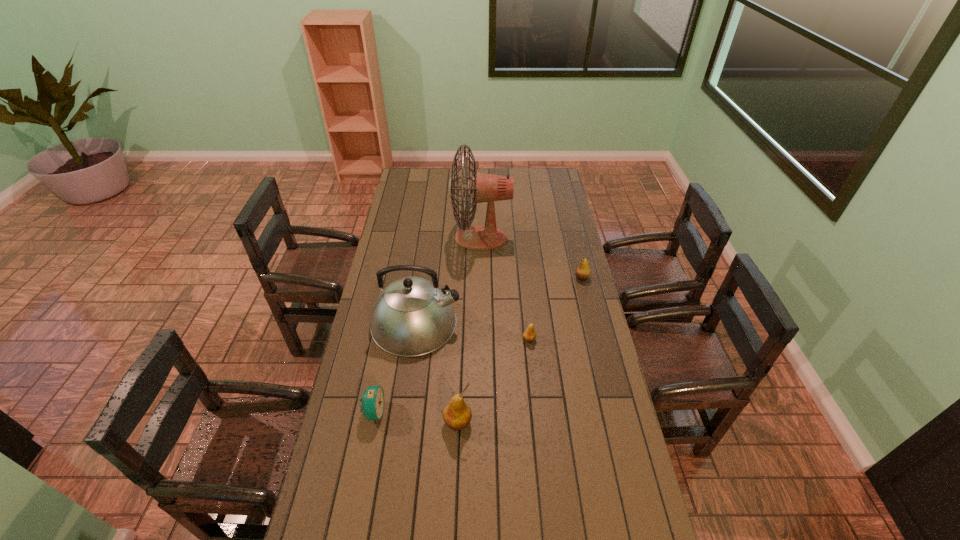
Locate an element on the screen. This screenshot has width=960, height=540. free region that satisfies the following two spatial constraints: 1. in front of the second farthest pear to direct airflow; 2. on the left side of the tallest object is located at coordinates (481, 340).

This screenshot has height=540, width=960. Identify the location of blank space that satisfies the following two spatial constraints: 1. on the back side of the nearest pear; 2. from the spout of the fifth shortest object. (462, 323).

Identify the location of vacant region that satisfies the following two spatial constraints: 1. in front of the fan to direct airflow; 2. on the left side of the shortest pear. Image resolution: width=960 pixels, height=540 pixels. (481, 340).

You are a GUI agent. You are given a task and a screenshot of the screen. Output one action in this format:
    pyautogui.click(x=<x>, y=<y>)
    Task: Click on the vacant area in the image that satisfies the following two spatial constraints: 1. on the front-facing side of the alarm clock; 2. on the left side of the nearest pear
    The width and height of the screenshot is (960, 540).
    Given the screenshot: What is the action you would take?
    pyautogui.click(x=372, y=422)

Identify the location of vacant space that satisfies the following two spatial constraints: 1. from the spout of the second tallest object; 2. on the right side of the leftmost pear. The width and height of the screenshot is (960, 540). (402, 422).

The height and width of the screenshot is (540, 960). Identify the location of free space that satisfies the following two spatial constraints: 1. on the back side of the leftmost pear; 2. on the left side of the shortest pear. (461, 340).

In order to click on free spot that satisfies the following two spatial constraints: 1. from the spout of the fifth shortest object; 2. on the back side of the tallest pear in this screenshot , I will do (402, 422).

This screenshot has width=960, height=540. What are the coordinates of `vacant space that satisfies the following two spatial constraints: 1. in front of the farthest pear to direct airflow; 2. on the left side of the fan` in the screenshot? It's located at (481, 278).

Locate an element on the screen. The image size is (960, 540). vacant space that satisfies the following two spatial constraints: 1. in front of the farthest object to direct airflow; 2. on the left side of the second tallest pear is located at coordinates (481, 278).